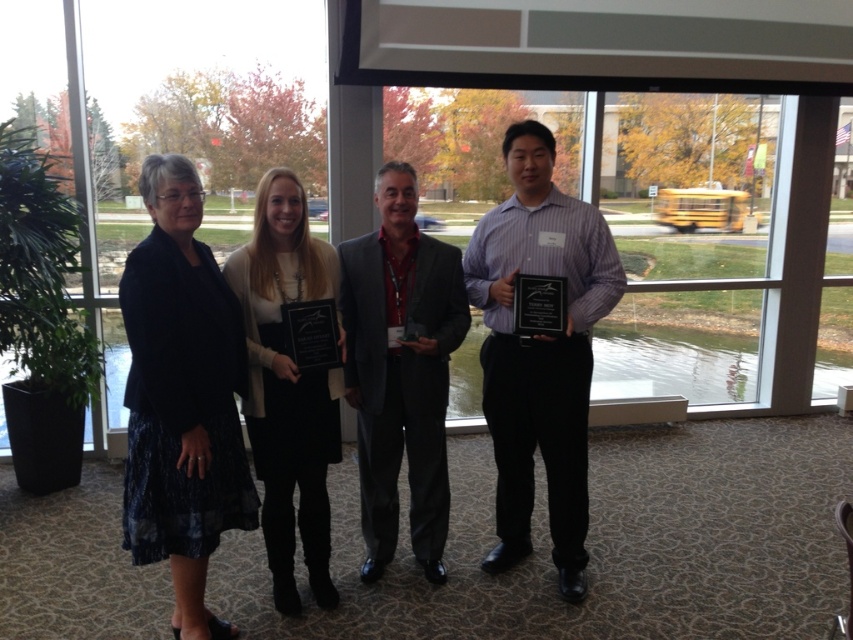
Question: Considering the real-world distances, which object is farthest from the dark gray suit at center?

Choices:
 (A) black glossy plaque at center
 (B) dark blue textured skirt at left

Answer: (B)

Question: Can you confirm if dark gray suit at center is wider than black glossy plaque at right?

Choices:
 (A) no
 (B) yes

Answer: (B)

Question: Is purple shirt at center below black glossy plaque at center?

Choices:
 (A) yes
 (B) no

Answer: (A)

Question: Does dark gray suit at center appear on the left side of matte black dress at center?

Choices:
 (A) no
 (B) yes

Answer: (A)

Question: Which point is closer to the camera?

Choices:
 (A) click(519, 316)
 (B) click(323, 490)
 (C) click(172, 275)
 (D) click(564, 244)

Answer: (C)

Question: Based on their relative distances, which object is farther from the black glossy plaque at center?

Choices:
 (A) dark gray suit at center
 (B) purple shirt at center
 (C) black glossy plaque at right
 (D) matte black dress at center

Answer: (B)